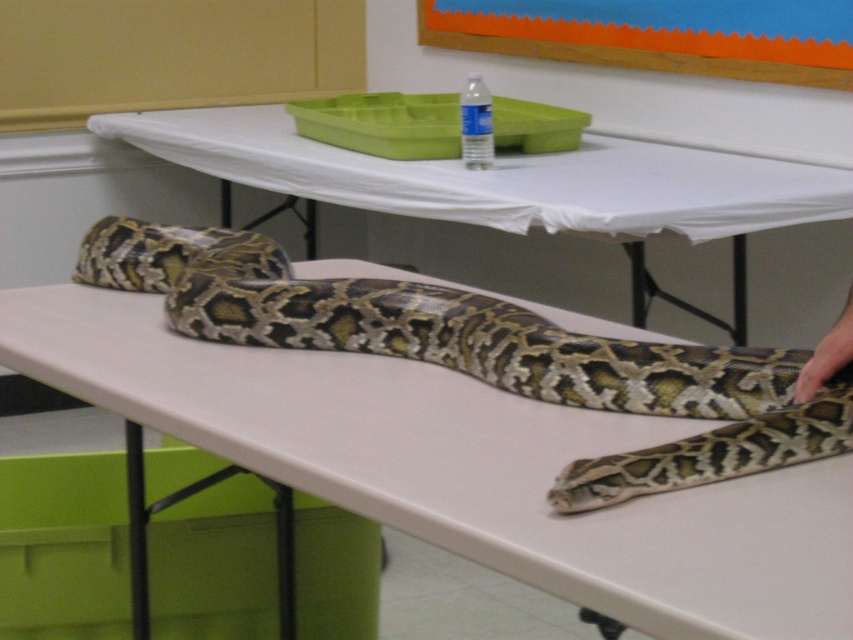
You are standing in front of the tables and want to pick up an object. Which of the two points, point [83,269] or point [627,65], is closer to you?

Point [83,269] is closer to the camera than point [627,65], so it is closer to you.

Looking at this image, you are a student who needs to place a 1.5 meter tall sculpture on the smooth white table at center. Considering the height of the table compared to the orange matte bulletin board at upper center, do you think the sculpture will fit on the table without touching the bulletin board?

The smooth white table at center is much taller than the orange matte bulletin board at upper center. Since the sculpture is 1.5 meters tall, placing it on the table would likely cause it to touch or go beyond the bulletin board, which is lower than the table. Therefore, the sculpture may not fit without obstruction.

You are a researcher observing the scene. You need to determine which object is taller between the patterned scales snake at center and the orange matte bulletin board at upper center. Based on the scene, can you tell which one is taller?

The patterned scales snake at center is shorter than the orange matte bulletin board at upper center, so the orange matte bulletin board at upper center is taller.